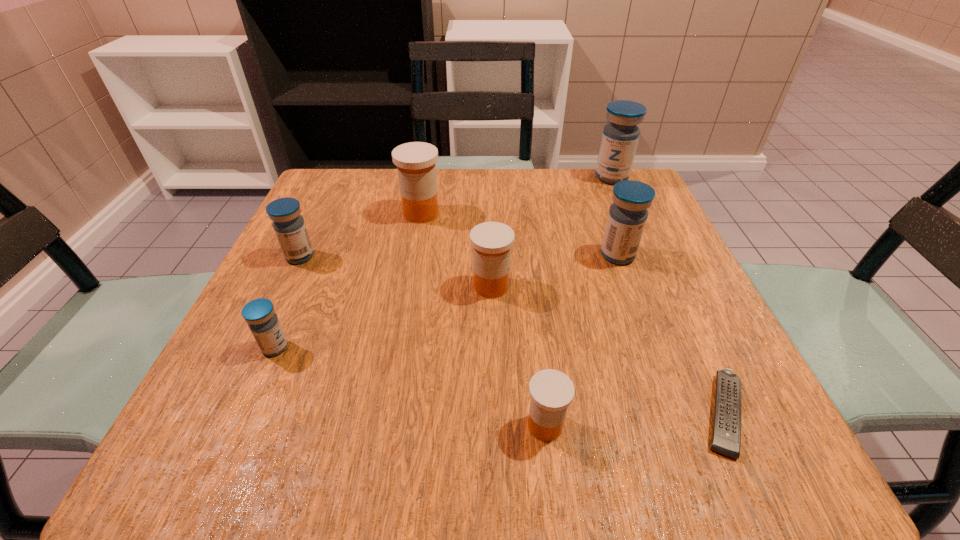
What are the coordinates of `the tallest medicine` in the screenshot? It's located at [x=620, y=136].

Where is `the biggest blue medicine`? This screenshot has width=960, height=540. the biggest blue medicine is located at coordinates (620, 136).

Find the location of a particular element. Image resolution: width=960 pixels, height=540 pixels. the fifth medicine from right to left is located at coordinates (416, 161).

The image size is (960, 540). Identify the location of the biggest orange medicine. (416, 161).

Locate an element on the screen. The height and width of the screenshot is (540, 960). the second biggest blue medicine is located at coordinates (627, 216).

Where is `the third nearest medicine`? This screenshot has width=960, height=540. the third nearest medicine is located at coordinates (492, 241).

Identify the location of the fourth medicine from right to left. This screenshot has width=960, height=540. (492, 241).

Locate an element on the screen. Image resolution: width=960 pixels, height=540 pixels. the second smallest blue medicine is located at coordinates (289, 226).

I want to click on the third nearest object, so click(262, 320).

Where is `the sixth farthest medicine`? the sixth farthest medicine is located at coordinates (262, 320).